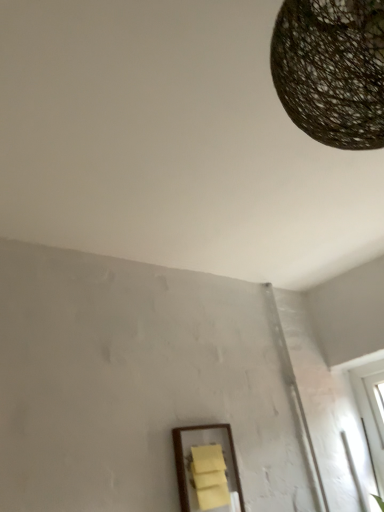
The height and width of the screenshot is (512, 384). What do you see at coordinates (206, 467) in the screenshot?
I see `wooden picture frame at lower center` at bounding box center [206, 467].

Find the location of a particular element. wooden picture frame at lower center is located at coordinates click(x=206, y=467).

At what (x,y) coordinates should I click in order to perform the action: click on wooden picture frame at lower center. Please return your answer as a coordinate pair (x, y). This screenshot has width=384, height=512. Looking at the image, I should click on (206, 467).